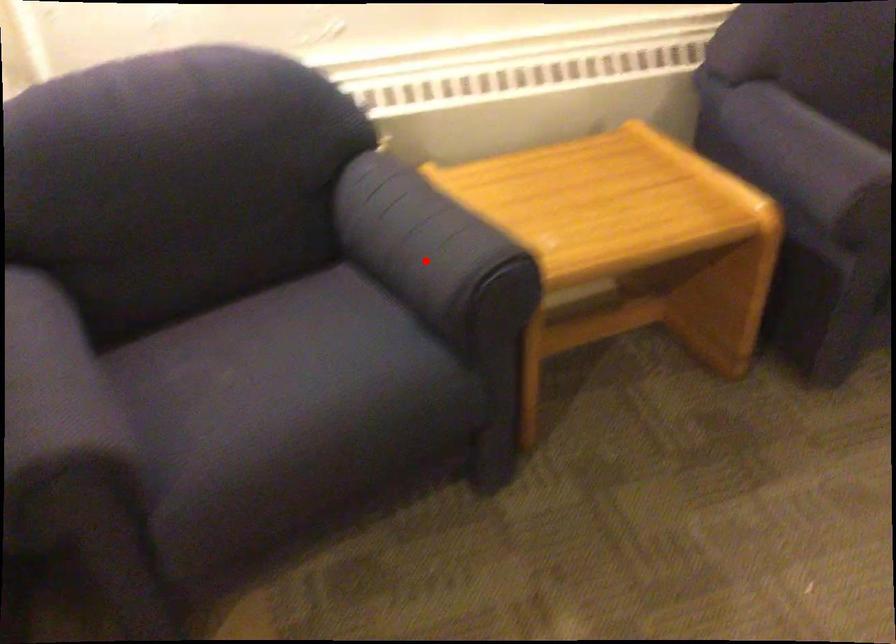
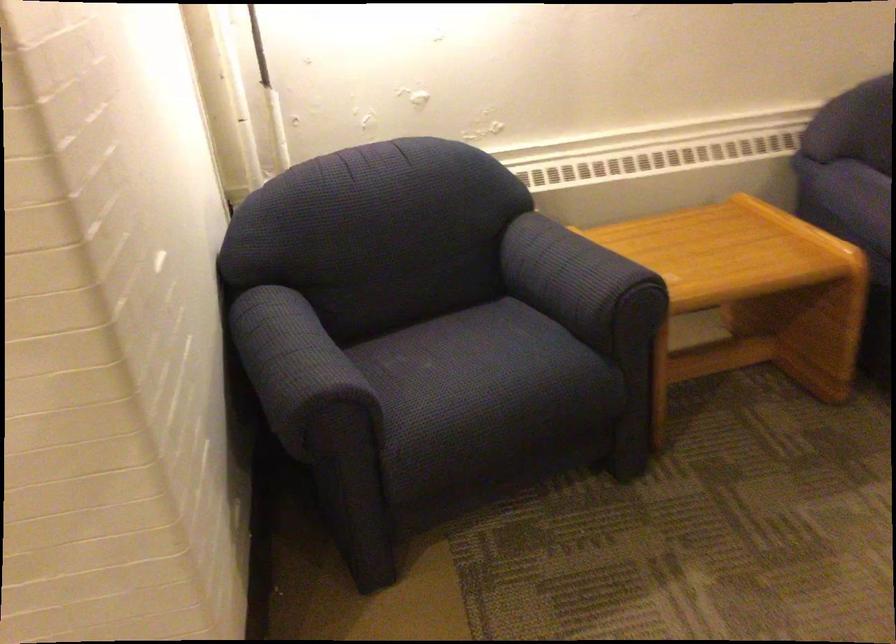
Locate, in the second image, the point that corresponds to the highlighted location in the first image.

(579, 281)